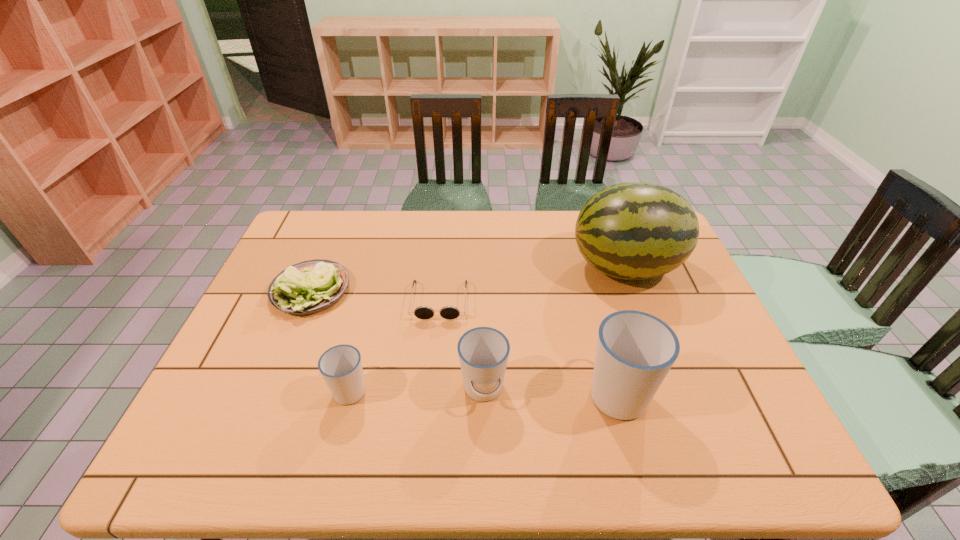
Where is `blank space located 0.080m with a handle on the side of the fourth tallest object`? This screenshot has width=960, height=540. blank space located 0.080m with a handle on the side of the fourth tallest object is located at coordinates (362, 345).

Find the location of a particular element. The image size is (960, 540). free space located 0.110m with a handle on the side of the fourth tallest object is located at coordinates (364, 336).

In order to click on free space located 0.230m with a handle on the side of the fourth tallest object in this screenshot , I will do `click(372, 305)`.

At what (x,y) coordinates should I click in order to perform the action: click on vacant space positioned 0.180m with a handle on the side of the tallest cup. Please return your answer as a coordinate pair (x, y). This screenshot has height=540, width=960. Looking at the image, I should click on [594, 308].

Locate an element on the screen. vacant space located with a handle on the side of the tallest cup is located at coordinates (588, 280).

You are a GUI agent. You are given a task and a screenshot of the screen. Output one action in this format:
    pyautogui.click(x=<x>, y=<y>)
    Task: Click on the vacant area situated with a handle on the side of the tallest cup
    The width and height of the screenshot is (960, 540).
    Given the screenshot: What is the action you would take?
    pyautogui.click(x=585, y=272)

You are a GUI agent. You are given a task and a screenshot of the screen. Output one action in this format:
    pyautogui.click(x=<x>, y=<y>)
    Task: Click on the vacant space located 0.260m on the front-facing side of the sunglasses
    
    Given the screenshot: What is the action you would take?
    pyautogui.click(x=429, y=404)

The width and height of the screenshot is (960, 540). Identify the location of free spot located at the stem end of the watermelon. (541, 267).

Find the location of `vacant space located 0.260m at the stem end of the watermelon`. vacant space located 0.260m at the stem end of the watermelon is located at coordinates [487, 267].

Where is `vacant space situated 0.370m at the stem end of the watermelon`? This screenshot has width=960, height=540. vacant space situated 0.370m at the stem end of the watermelon is located at coordinates (452, 267).